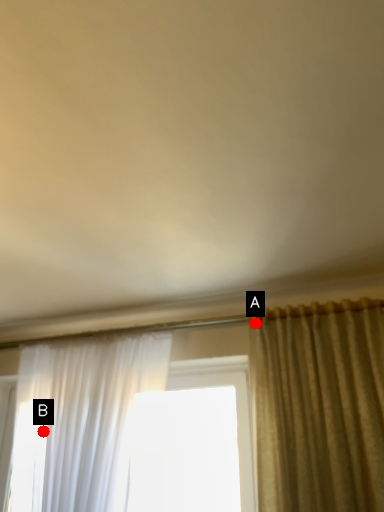
Question: Two points are circled on the image, labeled by A and B beside each circle. Which of the following is the closest to the observer?

Choices:
 (A) A is closer
 (B) B is closer

Answer: (A)